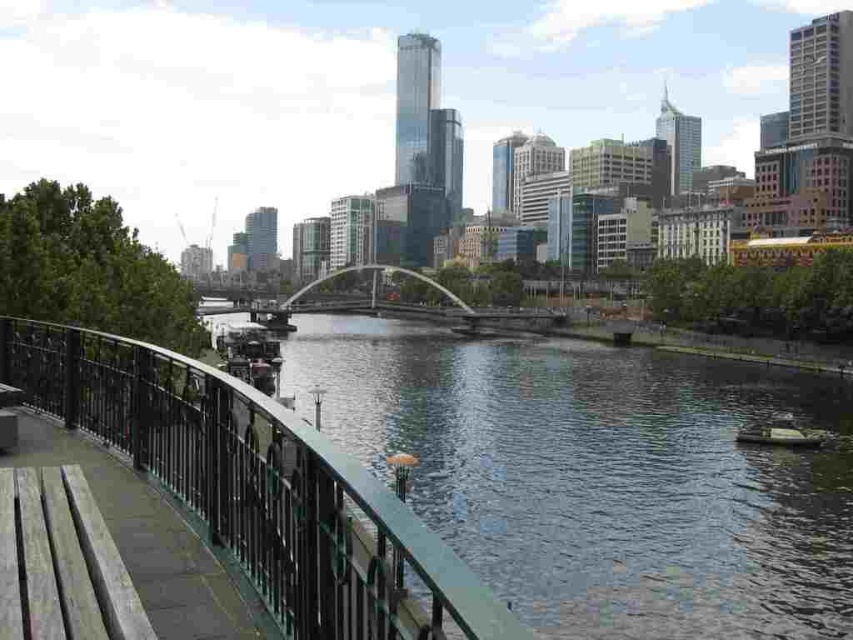
You are a photographer planning to capture the silver metallic bridge at center and the green plastic boat at lower right in a single frame. Based on their positions, which object would appear larger in your photo?

The silver metallic bridge at center would appear larger in the photo because it is closer to the viewer than the green plastic boat at lower right.

You are standing at the center of the bridge and want to find the green painted metal railing at lower left. According to the coordinates provided, in which direction should you look to locate it?

The green painted metal railing at lower left is located at point [257,486], which corresponds to the lower left area of the image. Therefore, you should look towards the lower left direction to find it.